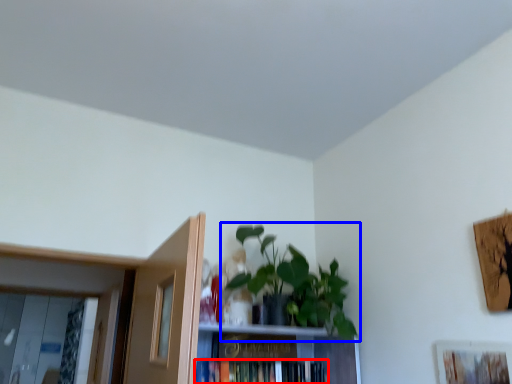
Question: Which object is further to the camera taking this photo, book (highlighted by a red box) or houseplant (highlighted by a blue box)?

Choices:
 (A) book
 (B) houseplant

Answer: (A)